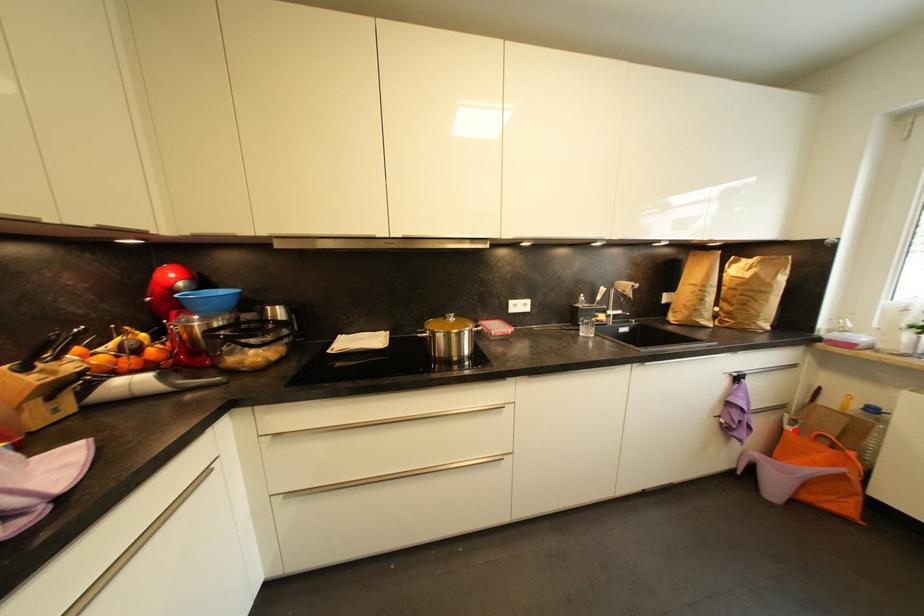
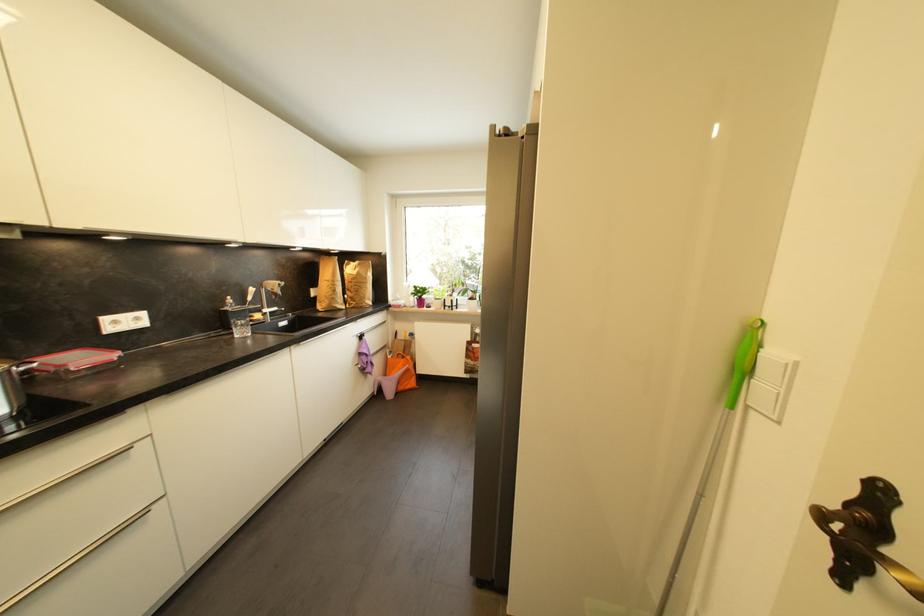
Question: I am providing you with two images of the same scene from different viewpoints. A red point is marked on the first image. Is the red point's position out of view in image 2?

Choices:
 (A) Yes
 (B) No

Answer: (B)